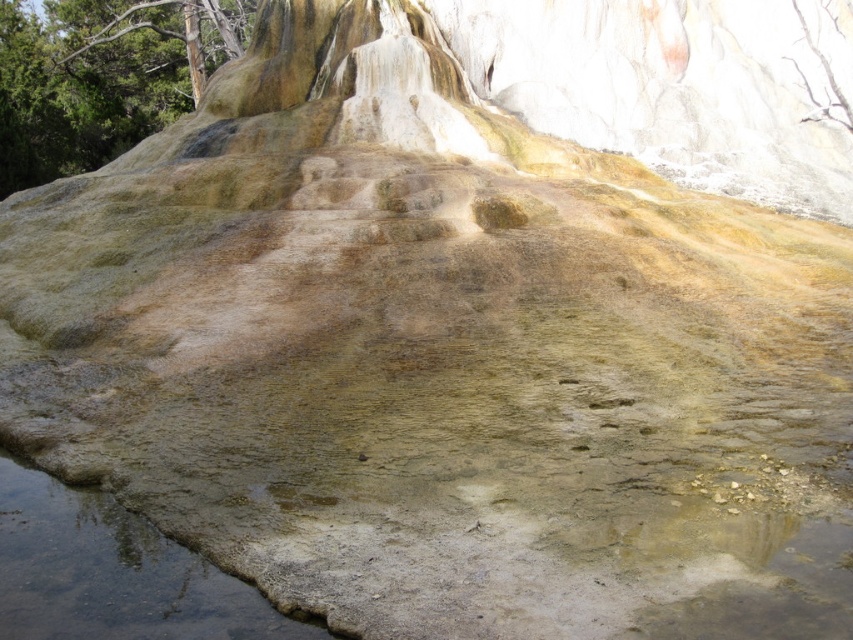
You are standing at the center of the image and want to walk to the clear water at bottom left. Which direction should you move relative to the smooth bark tree at upper left?

The smooth bark tree at upper left is to the left of the clear water at bottom left. Since you want to reach the clear water at bottom left, you should move to the right relative to the smooth bark tree at upper left.

From the picture: You are standing in the hot spring area and want to take a photo of the smooth bark tree at upper left and the clear water at bottom left. Which object should you focus on first if you want to capture both in one frame without moving the camera?

The smooth bark tree at upper left is taller than the clear water at bottom left, so you should focus on the smooth bark tree at upper left first to ensure both are in frame.